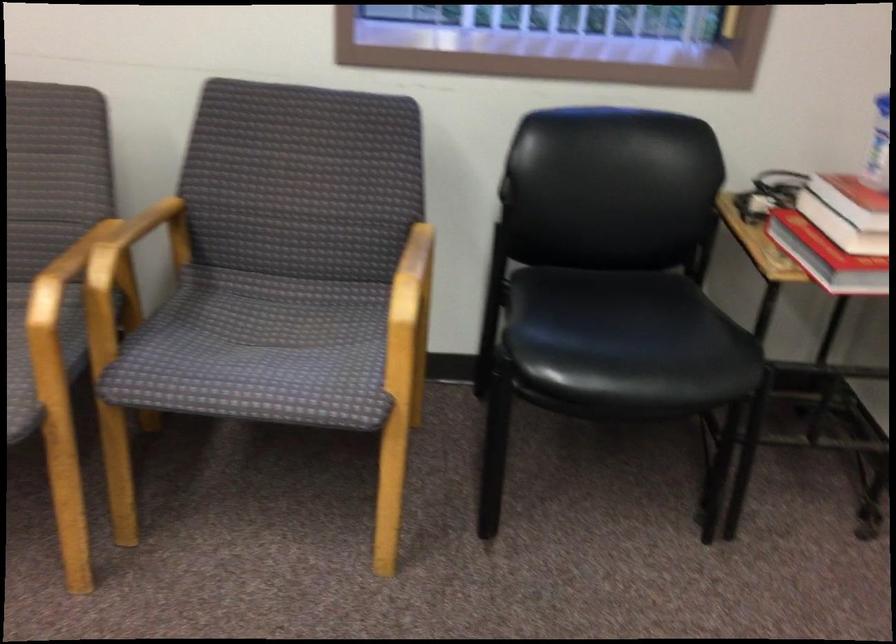
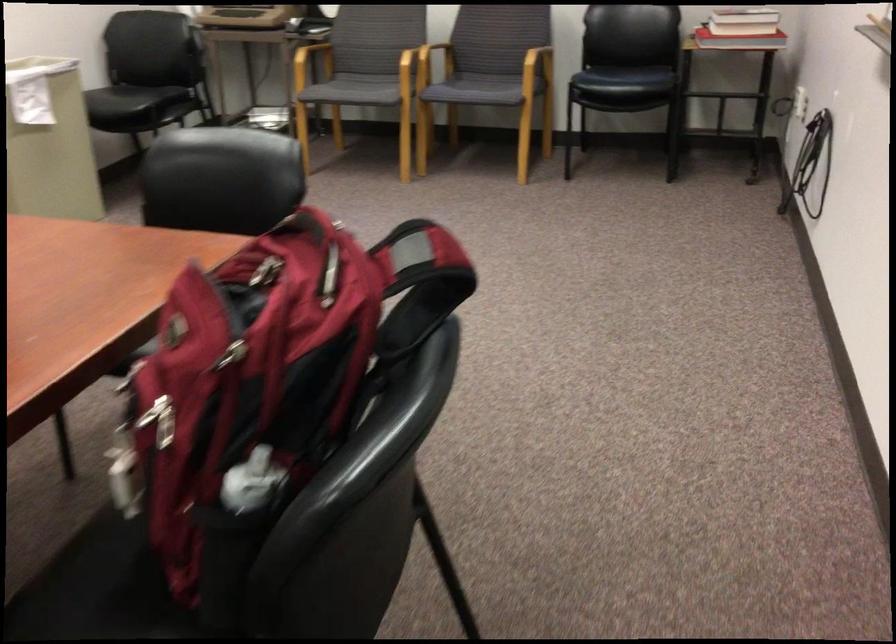
Question: Which direction would the cameraman need to move to produce the second image? Reply with the corresponding letter.

Choices:
 (A) Left
 (B) Right
 (C) Forward
 (D) Backward

Answer: (D)